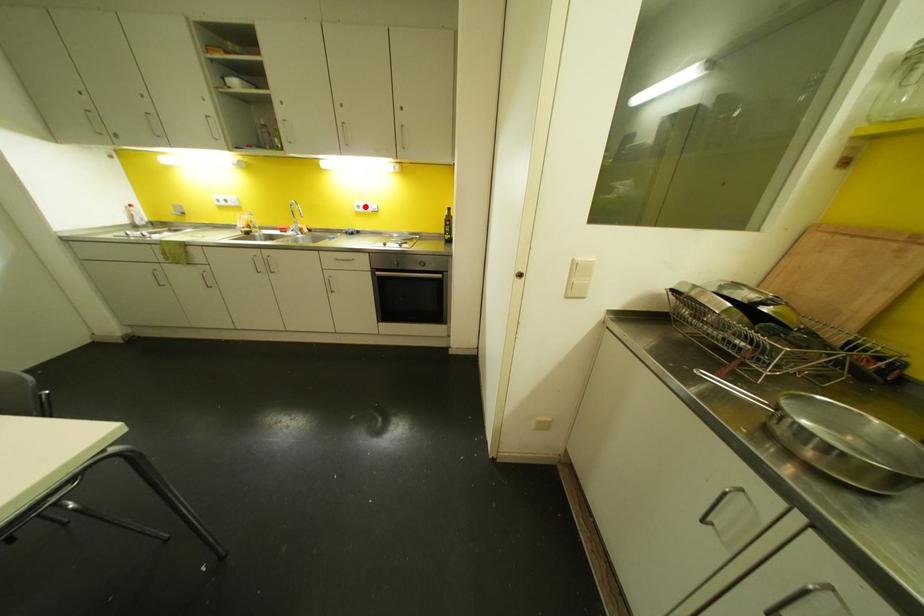
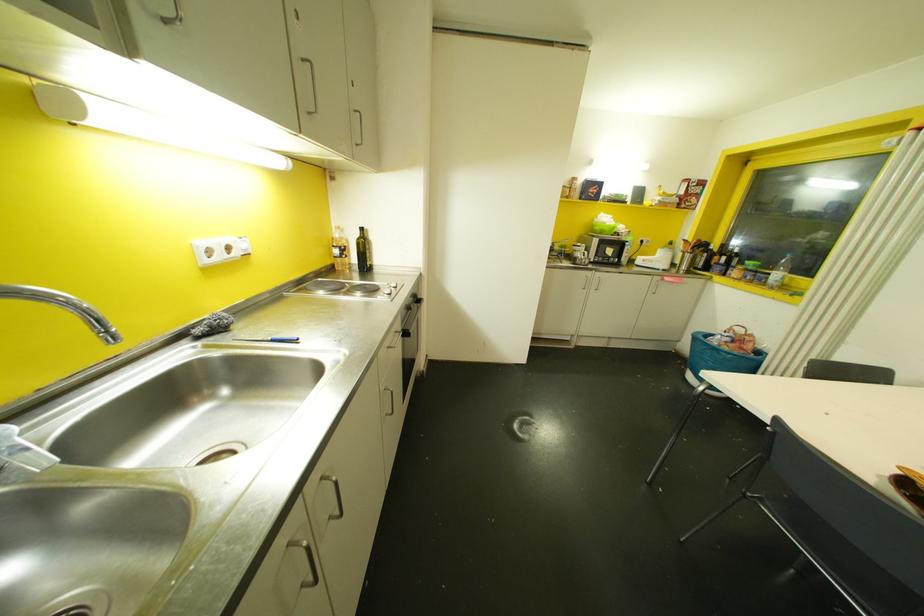
Question: I am providing you with two images of the same scene from different viewpoints. A red point is marked on the first image. At the location where the point appears in image 1, is it still visible in image 2?

Choices:
 (A) Yes
 (B) No

Answer: (A)